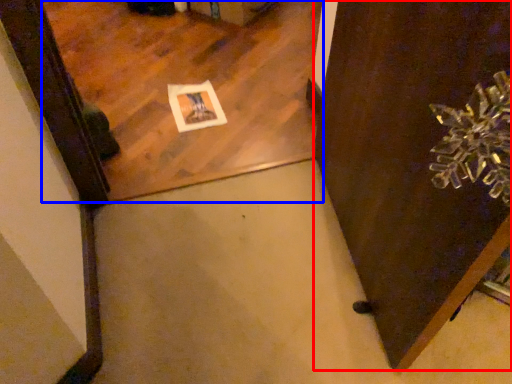
Question: Which object is further to the camera taking this photo, door (highlighted by a red box) or mirror (highlighted by a blue box)?

Choices:
 (A) door
 (B) mirror

Answer: (B)